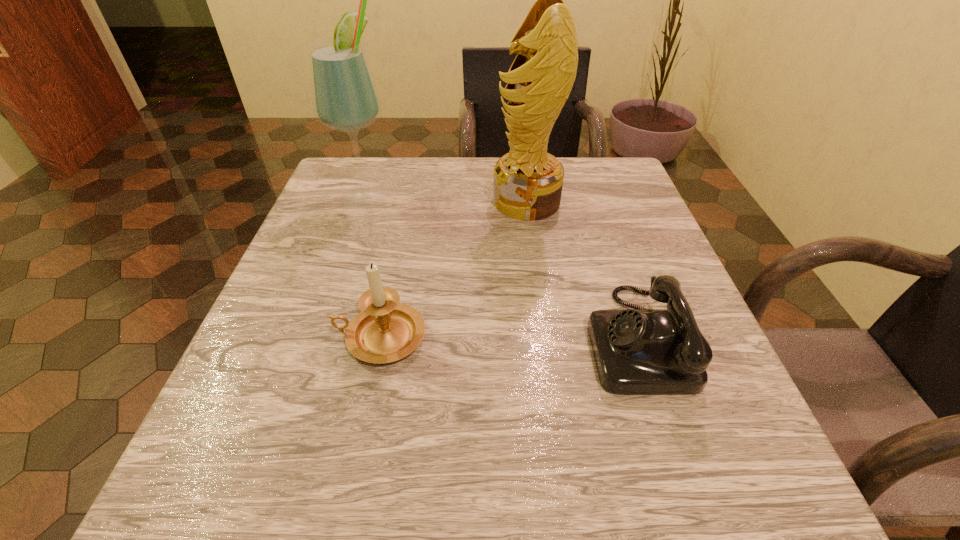
Locate an element on the screen. The height and width of the screenshot is (540, 960). free space located with a handle on the side of the candle holder is located at coordinates (283, 338).

This screenshot has width=960, height=540. Identify the location of free space located on the dial of the telephone. (350, 338).

In order to click on vacant space located on the dial of the telephone in this screenshot , I will do `click(464, 338)`.

The image size is (960, 540). Find the location of `vacant space located 0.130m on the dial of the telephone`. vacant space located 0.130m on the dial of the telephone is located at coordinates (508, 338).

Where is `alcohol that is at the far edge`? The width and height of the screenshot is (960, 540). alcohol that is at the far edge is located at coordinates pyautogui.click(x=345, y=98).

This screenshot has height=540, width=960. In order to click on award that is at the far edge in this screenshot , I will do `click(528, 181)`.

Where is `alcohol situated at the left edge`? The image size is (960, 540). alcohol situated at the left edge is located at coordinates (345, 98).

Where is `candle holder that is at the left edge`? The width and height of the screenshot is (960, 540). candle holder that is at the left edge is located at coordinates (385, 331).

Identify the location of object that is at the right edge. (637, 351).

Where is `object that is at the far left corner`? This screenshot has width=960, height=540. object that is at the far left corner is located at coordinates (345, 98).